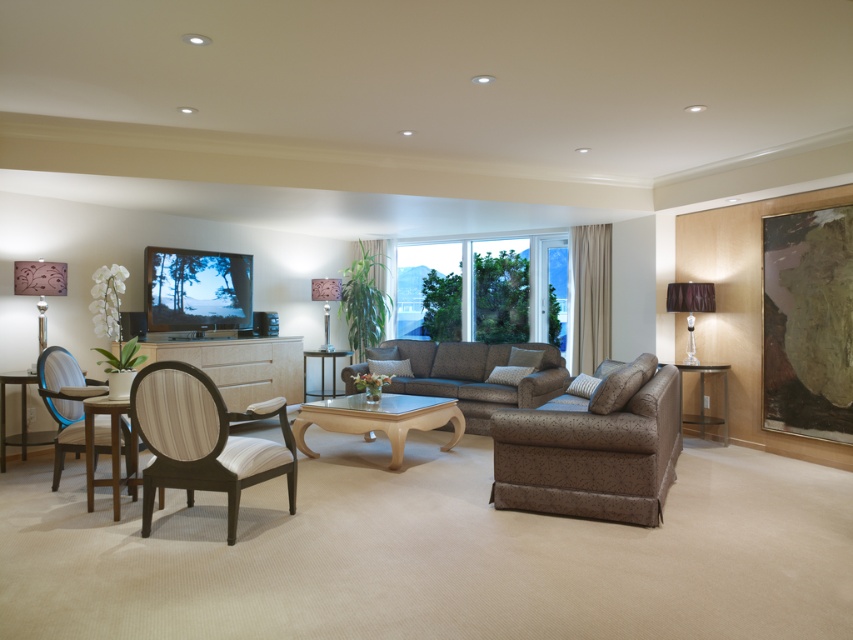
Who is more forward, (645, 426) or (692, 289)?

Point (645, 426) is more forward.

You are a GUI agent. You are given a task and a screenshot of the screen. Output one action in this format:
    pyautogui.click(x=<x>, y=<y>)
    Task: Click on the brown fabric couch at center
    The width and height of the screenshot is (853, 640).
    Given the screenshot: What is the action you would take?
    pyautogui.click(x=593, y=449)

Which is more to the right, wooden table at left or clear glass side table at right?

clear glass side table at right is more to the right.

Can you confirm if wooden table at left is positioned below clear glass side table at right?

No.

Is point (0, 403) farther from camera compared to point (701, 419)?

No, (0, 403) is in front of (701, 419).

The image size is (853, 640). Find the location of `wooden table at left`. wooden table at left is located at coordinates [x=20, y=417].

Does wooden armchair with white cushioning at lower left have a larger size compared to translucent blue armchair at left?

Incorrect, wooden armchair with white cushioning at lower left is not larger than translucent blue armchair at left.

Is wooden armchair with white cushioning at lower left shorter than translucent blue armchair at left?

Correct, wooden armchair with white cushioning at lower left is not as tall as translucent blue armchair at left.

Is point (280, 417) more distant than point (61, 432)?

No.

Locate an element on the screen. The height and width of the screenshot is (640, 853). wooden armchair with white cushioning at lower left is located at coordinates (202, 440).